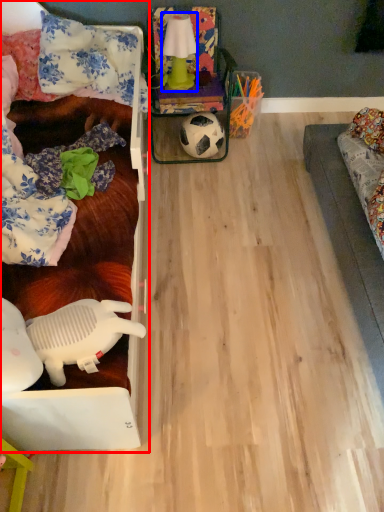
Question: Among these objects, which one is farthest to the camera, furniture (highlighted by a red box) or lamp (highlighted by a blue box)?

Choices:
 (A) furniture
 (B) lamp

Answer: (B)